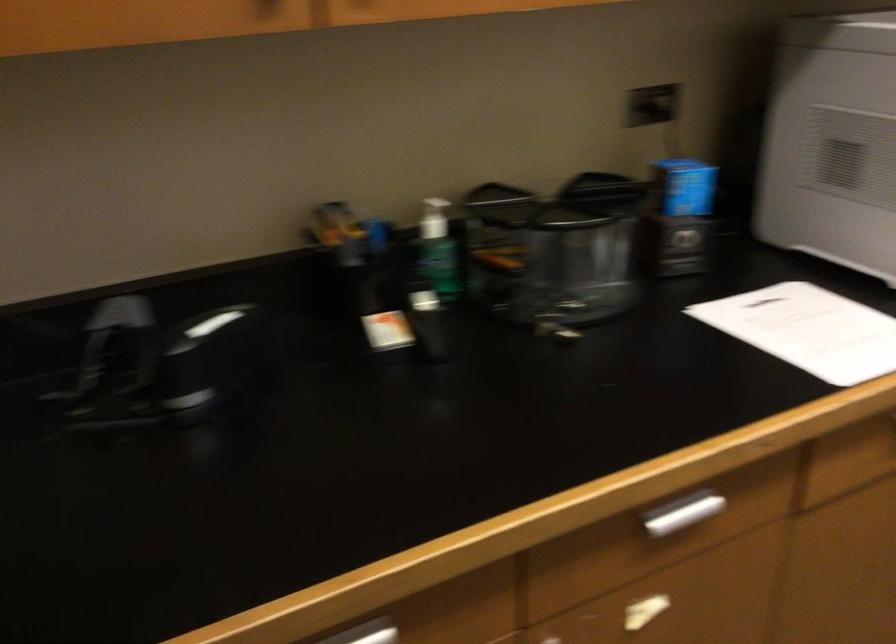
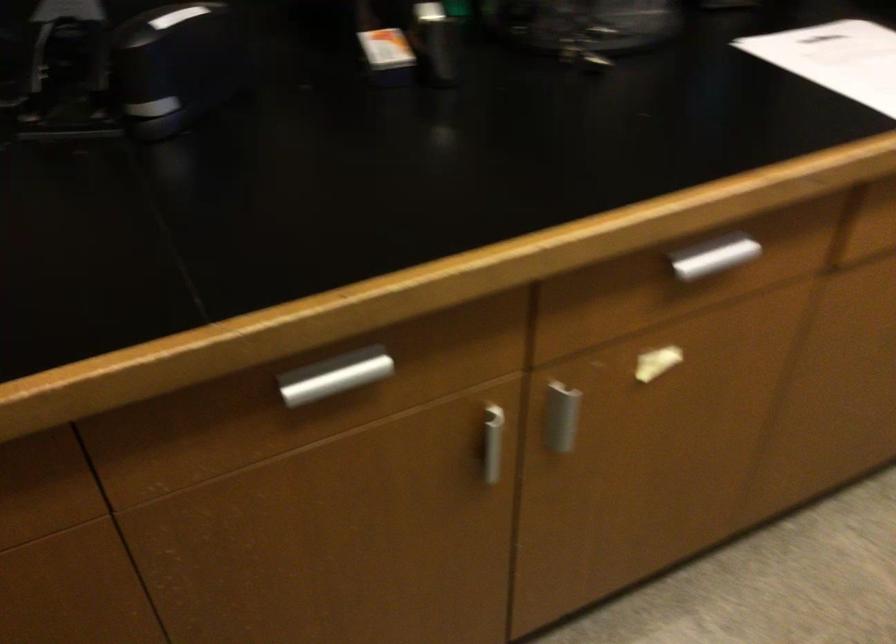
The point at (385, 337) is marked in the first image. Where is the corresponding point in the second image?

(386, 57)